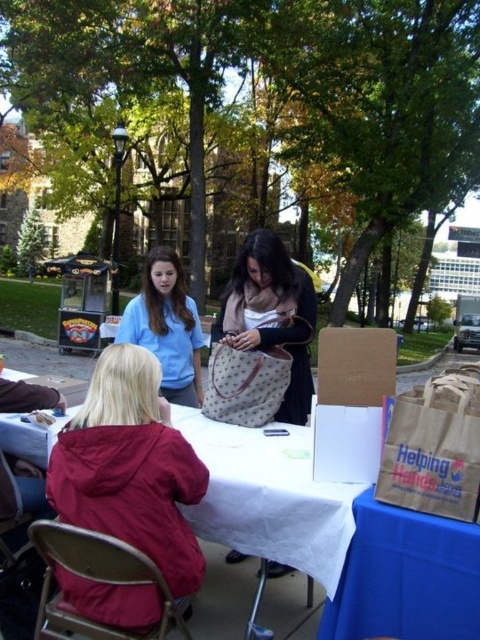
Question: Which is nearer to the matte red jacket at lower left?

Choices:
 (A) matte blue shirt at center
 (B) white fabric picnic table at center
 (C) leather-like beige bag at center

Answer: (B)

Question: Does blue fabric tablecloth at lower right have a greater width compared to matte blue shirt at center?

Choices:
 (A) yes
 (B) no

Answer: (B)

Question: Which object is closer to the camera taking this photo?

Choices:
 (A) matte blue shirt at center
 (B) matte red jacket at lower left
 (C) white fabric picnic table at center
 (D) leather-like beige bag at center

Answer: (B)

Question: From the image, what is the correct spatial relationship of matte red jacket at lower left in relation to leather-like beige bag at center?

Choices:
 (A) above
 (B) below

Answer: (B)

Question: Which point is farther to the camera?

Choices:
 (A) (356, 515)
 (B) (262, 278)

Answer: (B)

Question: Does white fabric picnic table at center come in front of matte red jacket at lower left?

Choices:
 (A) no
 (B) yes

Answer: (A)